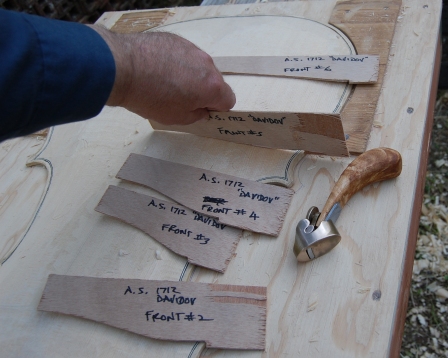
The height and width of the screenshot is (358, 448). I want to click on wood handle, so click(x=369, y=162).